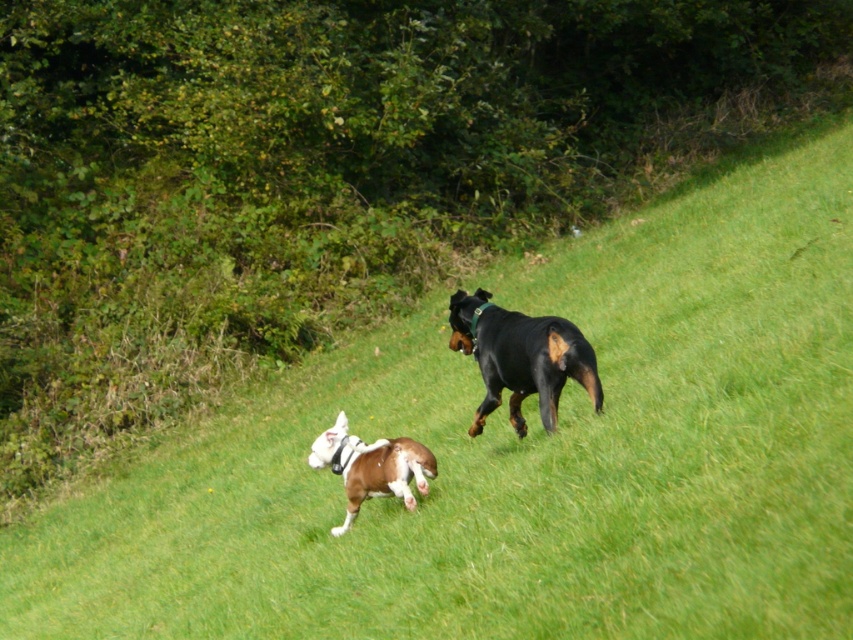
You are a dog trainer observing two dogs running in a grassy field. You notice the black glossy dog at center and the brown glossy dog at center. Based on their sizes, which dog is more likely to require a larger dog bed?

The black glossy dog at center requires a larger dog bed since its width is larger than the brown glossy dog at center.

Where is the black glossy dog at center located in the image?

The black glossy dog at center is located at point (521, 358) in the image.

You are standing in the field and see both the black glossy dog at center and the brown glossy dog at center. Which dog is nearer to you?

The black glossy dog at center is closer to the viewer than the brown glossy dog at center.